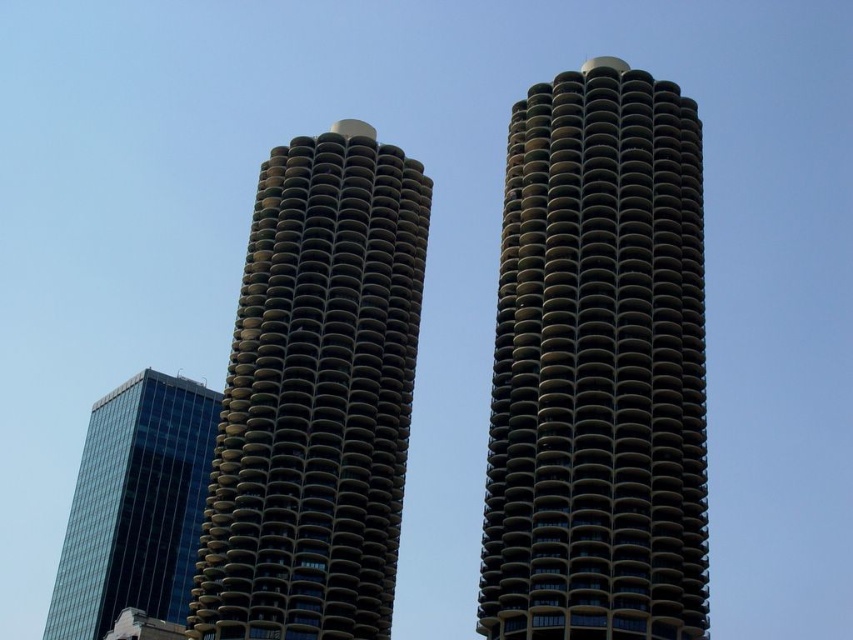
You are an architect evaluating the two towers in the image. Based on the scene, which tower, the dark brown concrete tower at center or the green concrete tower at center, has a larger base width?

The dark brown concrete tower at center might be wider than the green concrete tower at center, so the dark brown concrete tower at center likely has a larger base width.

You are standing in front of the two high rise buildings. You see two points marked on the buildings. The first point is at coordinate point [289,176] and the second point is at coordinate point [78,618]. Which of these points is closer to you?

Point [289,176] is closer to the camera than point [78,618], so the first point is closer to you.